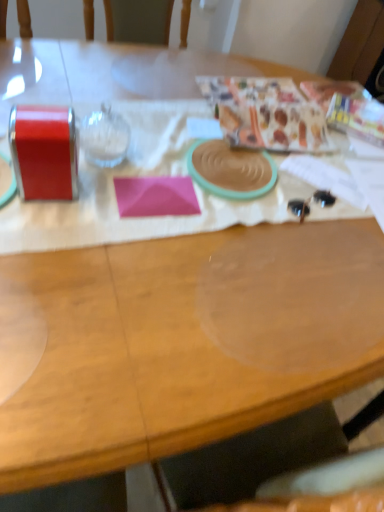
Identify the location of unoccupied region to the right of transparent glass at upper left. The height and width of the screenshot is (512, 384). (175, 162).